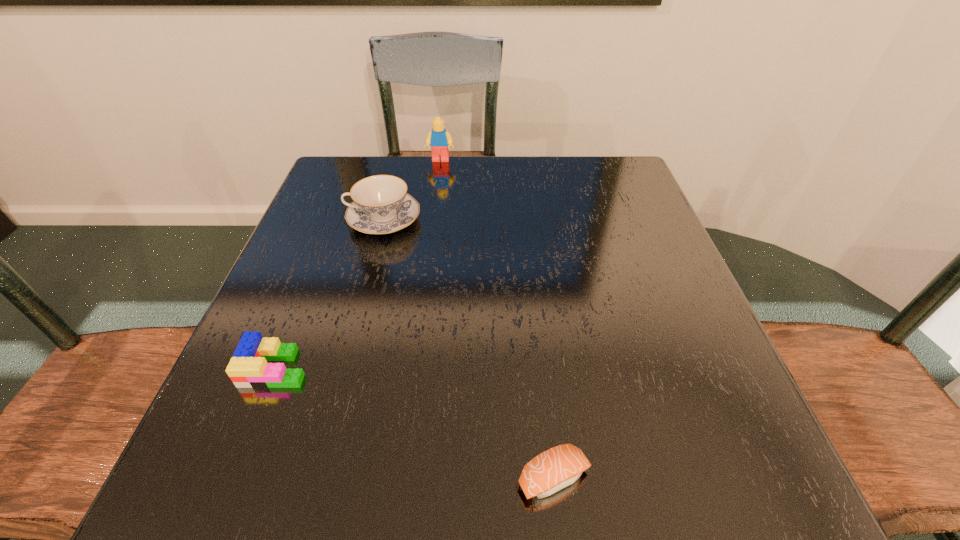
Image resolution: width=960 pixels, height=540 pixels. Find the location of `empty space between the chinaware and the left Lego`. empty space between the chinaware and the left Lego is located at coordinates 329,294.

Identify the location of free spot between the taller Lego and the chinaware. (412, 190).

Image resolution: width=960 pixels, height=540 pixels. What are the coordinates of `free area in between the farthest object and the second tallest object` in the screenshot? It's located at (412, 190).

Where is `vacant point located between the sushi and the taller Lego`? Image resolution: width=960 pixels, height=540 pixels. vacant point located between the sushi and the taller Lego is located at coordinates (497, 319).

Identify which object is the second nearest to the right Lego. Please provide its 2D coordinates. Your answer should be formatted as a tuple, i.e. [(x, y)], where the tuple contains the x and y coordinates of a point satisfying the conditions above.

[(248, 368)]

Find the location of a particular element. The width and height of the screenshot is (960, 540). object that is the closest to the third nearest object is located at coordinates (439, 139).

This screenshot has width=960, height=540. In order to click on free space that satisfies the following two spatial constraints: 1. on the back side of the nearer Lego; 2. with the handle on the side of the third nearest object in this screenshot , I will do `click(334, 220)`.

Identify the location of vacant space that satisfies the following two spatial constraints: 1. on the front-facing side of the sushi; 2. on the left side of the taller Lego. Image resolution: width=960 pixels, height=540 pixels. (400, 478).

This screenshot has height=540, width=960. I want to click on vacant region that satisfies the following two spatial constraints: 1. on the back side of the shorter Lego; 2. with the handle on the side of the third shortest object, so (334, 220).